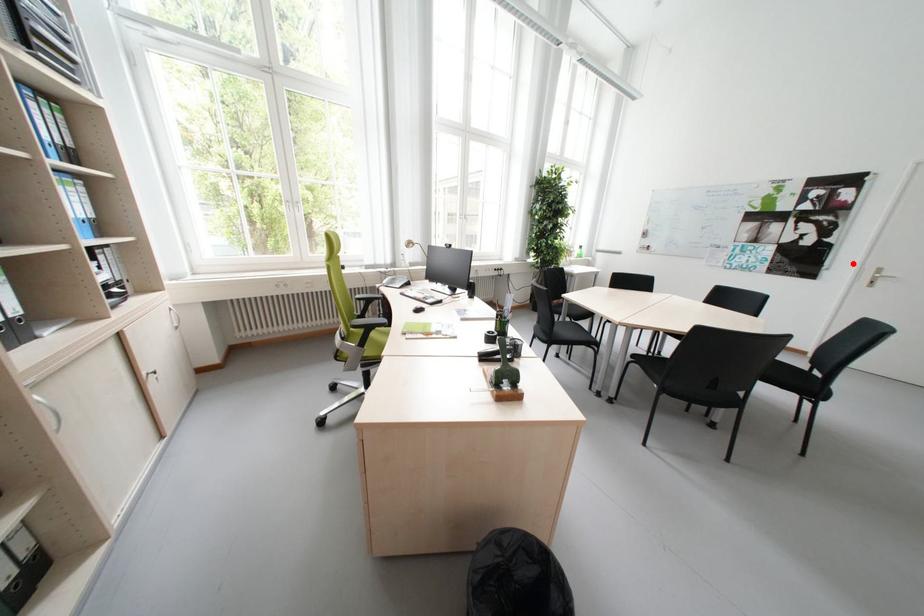
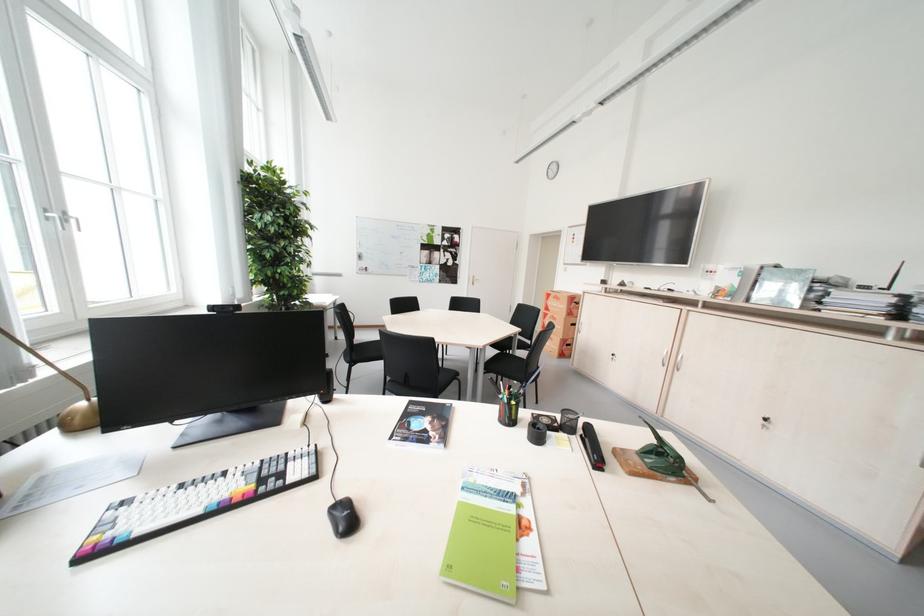
In the second image, find the point that corresponds to the highlighted location in the first image.

(473, 275)